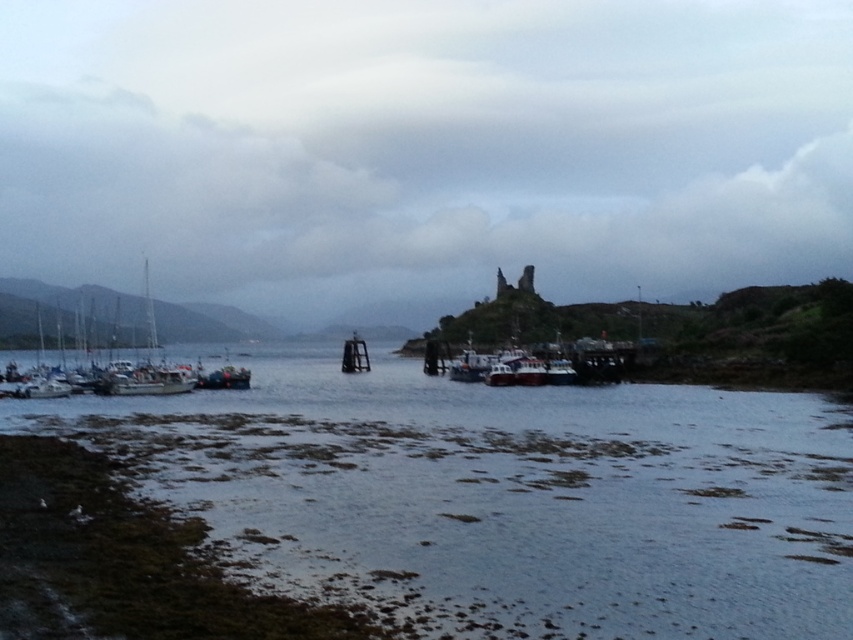
You are a marine biologist studying the coastal area. You need to determine which object in the scene occupies a larger area. Based on the image, which is bigger in size between the smooth water at center and the black matte dock at center?

The black matte dock at center is larger in size compared to the smooth water at center.